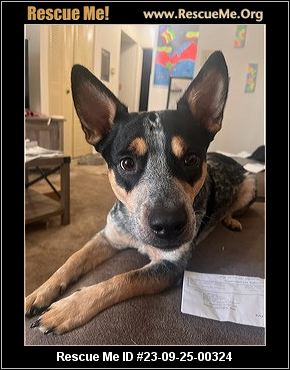
Where is `wall`? wall is located at coordinates (216, 35).